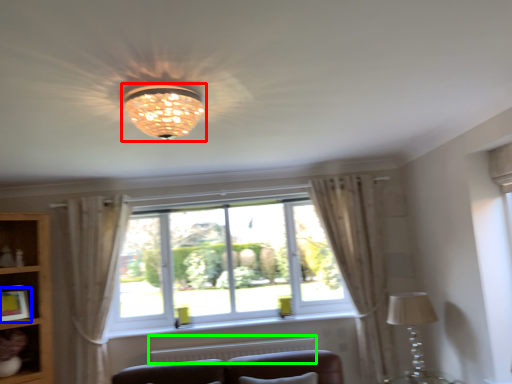
Question: Based on their relative distances, which object is farther from lamp (highlighted by a red box)? Choose from picture frame (highlighted by a blue box) and radiator (highlighted by a green box).

Choices:
 (A) picture frame
 (B) radiator

Answer: (A)